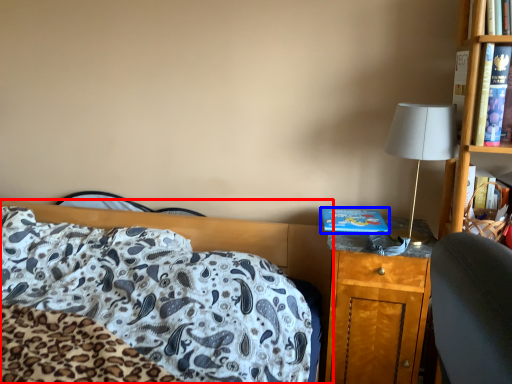
Question: Among these objects, which one is nearest to the camera, bed (highlighted by a red box) or hardback book (highlighted by a blue box)?

Choices:
 (A) bed
 (B) hardback book

Answer: (A)